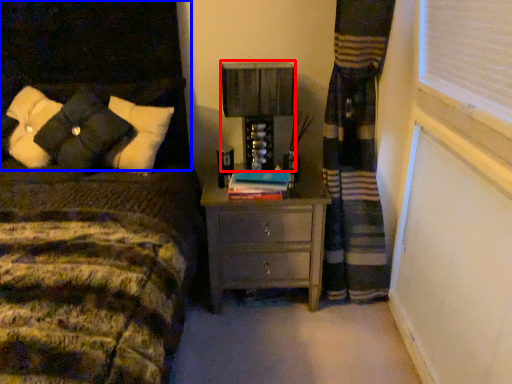
Question: Among these objects, which one is farthest to the camera, table lamp (highlighted by a red box) or headboard (highlighted by a blue box)?

Choices:
 (A) table lamp
 (B) headboard

Answer: (A)